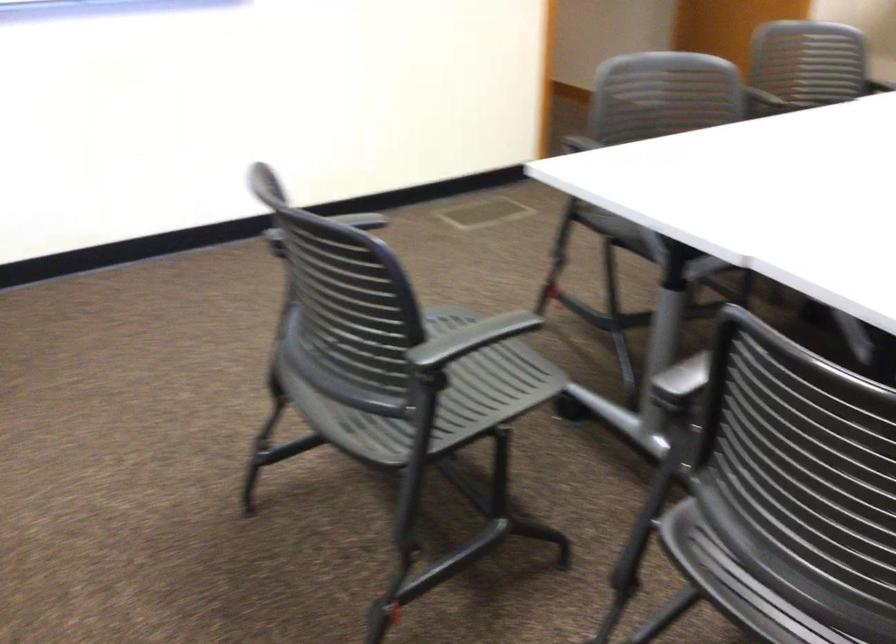
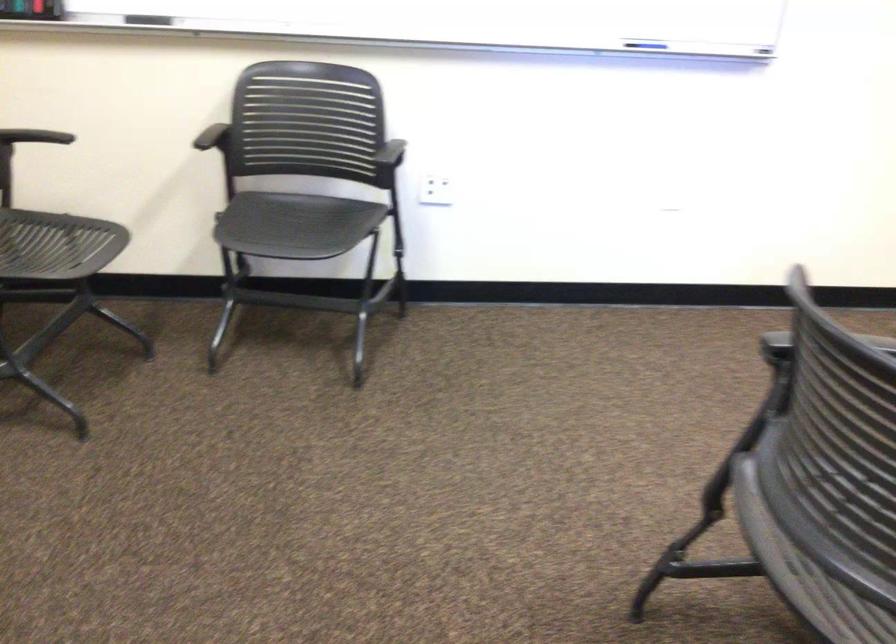
Question: The camera is either moving clockwise (left) or counter-clockwise (right) around the object. The first image is from the beginning of the video and the second image is from the end. Is the camera moving left or right when shooting the video?

Choices:
 (A) Left
 (B) Right

Answer: (B)